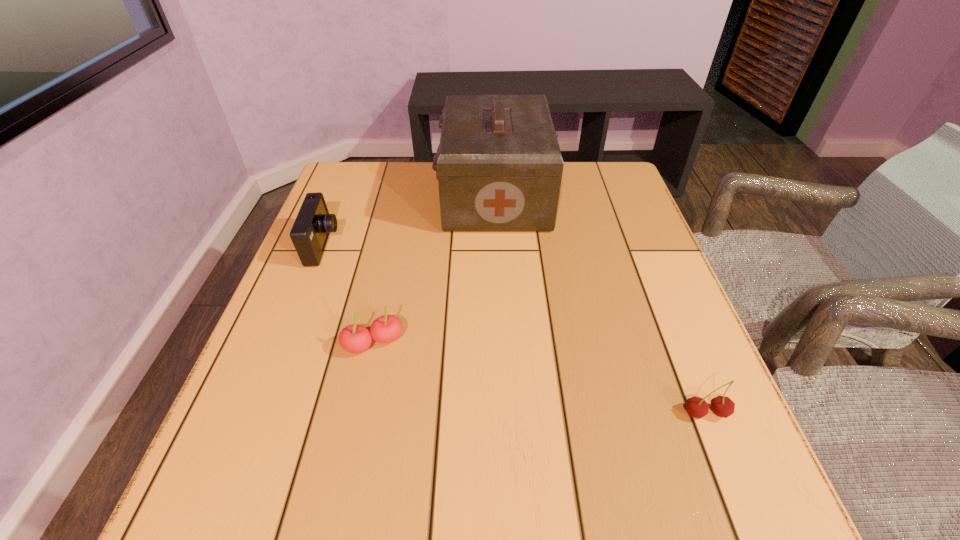
At what (x,y) coordinates should I click in order to perform the action: click on free spot between the third object from right to left and the third object from left to right. Please return your answer as a coordinate pair (x, y). Looking at the image, I should click on (435, 269).

Where is `vacant area between the tallest object and the leftmost object`? vacant area between the tallest object and the leftmost object is located at coordinates [409, 221].

At what (x,y) coordinates should I click in order to perform the action: click on empty space that is in between the first-aid kit and the leftmost object. Please return your answer as a coordinate pair (x, y). The width and height of the screenshot is (960, 540). Looking at the image, I should click on (409, 221).

The image size is (960, 540). I want to click on vacant region between the tallest object and the leftmost object, so click(x=409, y=221).

At what (x,y) coordinates should I click in order to perform the action: click on free spot between the third object from right to left and the first-aid kit. Please return your answer as a coordinate pair (x, y). Looking at the image, I should click on (435, 269).

The height and width of the screenshot is (540, 960). I want to click on free space that is in between the first-aid kit and the third object from right to left, so click(x=435, y=269).

Find the location of a particular element. unoccupied position between the third object from left to right and the rightmost object is located at coordinates (601, 305).

Image resolution: width=960 pixels, height=540 pixels. I want to click on empty space that is in between the left cherry and the rightmost object, so click(x=540, y=379).

Where is `vacant point located between the rightmost object and the third object from left to right`? vacant point located between the rightmost object and the third object from left to right is located at coordinates (601, 305).

Find the location of a particular element. free space that is in between the tallest object and the nearer cherry is located at coordinates (601, 305).